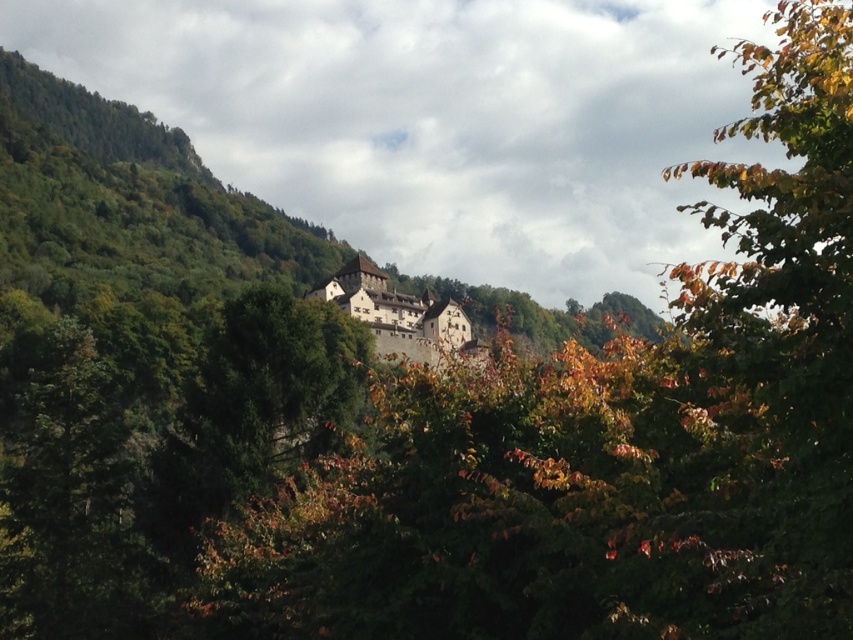
Question: Where is green matte tree at left located in relation to brown stone castle at center in the image?

Choices:
 (A) right
 (B) left

Answer: (B)

Question: Can you confirm if green matte tree at left is positioned above brown stone castle at center?

Choices:
 (A) no
 (B) yes

Answer: (A)

Question: Is green matte tree at left to the right of brown stone castle at center from the viewer's perspective?

Choices:
 (A) yes
 (B) no

Answer: (B)

Question: Which point is farther to the camera?

Choices:
 (A) green matte tree at left
 (B) brown stone castle at center

Answer: (A)

Question: Which point is farther from the camera taking this photo?

Choices:
 (A) (389, 298)
 (B) (49, 620)

Answer: (A)